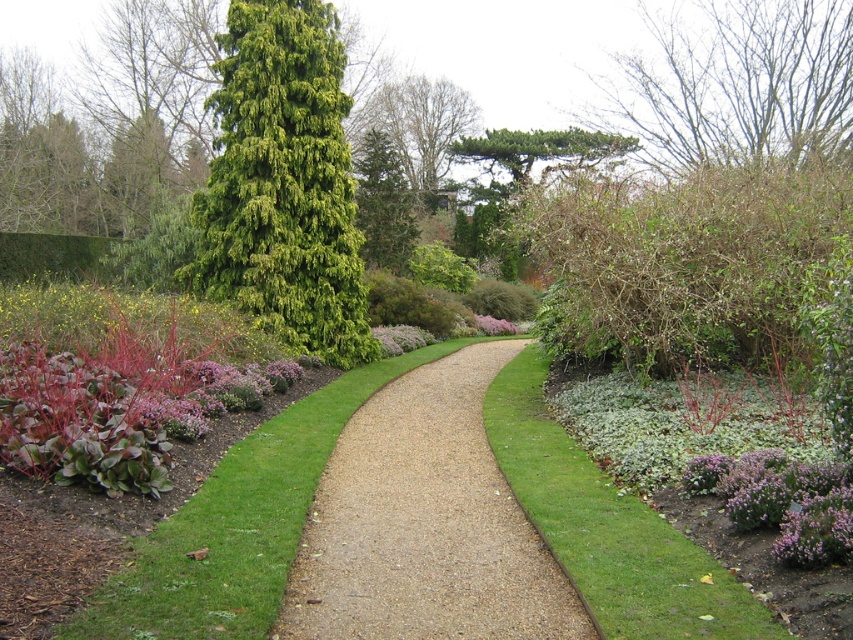
Who is positioned more to the right, green textured evergreen tree at upper left or purple fluffy flower at center?

Positioned to the right is purple fluffy flower at center.

Describe the element at coordinates (151, 102) in the screenshot. I see `green textured evergreen tree at upper left` at that location.

Find the location of a particular element. This screenshot has height=640, width=853. green textured evergreen tree at upper left is located at coordinates (151, 102).

Which is above, green grass at lower left or purple matte flower at lower right?

purple matte flower at lower right is higher up.

The width and height of the screenshot is (853, 640). What do you see at coordinates (238, 525) in the screenshot?
I see `green grass at lower left` at bounding box center [238, 525].

Is point (450, 342) positioned behind point (782, 461)?

Yes, it is.

This screenshot has width=853, height=640. I want to click on green grass at lower left, so click(238, 525).

Does green leafy bush at upper right have a lesser height compared to green textured evergreen tree at center?

Indeed, green leafy bush at upper right has a lesser height compared to green textured evergreen tree at center.

Which is below, green leafy bush at upper right or green textured evergreen tree at center?

green leafy bush at upper right is lower down.

Which is in front, point (596, 310) or point (370, 179)?

Point (596, 310) is in front.

The width and height of the screenshot is (853, 640). Find the location of `green leafy bush at upper right`. green leafy bush at upper right is located at coordinates (683, 260).